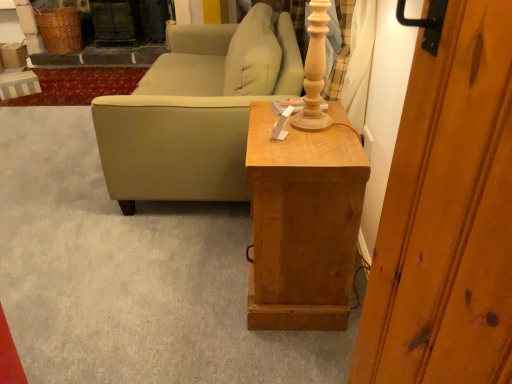
Question: Is wooden side table at center surrounding beige fabric couch at center?

Choices:
 (A) no
 (B) yes

Answer: (A)

Question: Is beige fabric couch at center at the back of wooden side table at center?

Choices:
 (A) no
 (B) yes

Answer: (A)

Question: Is the position of wooden side table at center less distant than that of beige fabric couch at center?

Choices:
 (A) yes
 (B) no

Answer: (A)

Question: From a real-world perspective, is wooden side table at center over beige fabric couch at center?

Choices:
 (A) yes
 (B) no

Answer: (B)

Question: From the image's perspective, is wooden side table at center located beneath beige fabric couch at center?

Choices:
 (A) no
 (B) yes

Answer: (B)

Question: Is wooden side table at center to the right of beige fabric couch at center from the viewer's perspective?

Choices:
 (A) yes
 (B) no

Answer: (A)

Question: Does beige fabric couch at center have a lesser height compared to wooden side table at center?

Choices:
 (A) no
 (B) yes

Answer: (A)

Question: Can you confirm if beige fabric couch at center is thinner than wooden side table at center?

Choices:
 (A) no
 (B) yes

Answer: (A)

Question: From the image's perspective, is beige fabric couch at center beneath wooden side table at center?

Choices:
 (A) yes
 (B) no

Answer: (B)

Question: Is beige fabric couch at center beside wooden side table at center?

Choices:
 (A) no
 (B) yes

Answer: (A)

Question: Is beige fabric couch at center to the left of wooden side table at center from the viewer's perspective?

Choices:
 (A) no
 (B) yes

Answer: (B)

Question: Does beige fabric couch at center come in front of wooden side table at center?

Choices:
 (A) no
 (B) yes

Answer: (A)

Question: Looking at their shapes, would you say beige fabric couch at center is wider or thinner than wooden side table at center?

Choices:
 (A) wide
 (B) thin

Answer: (A)